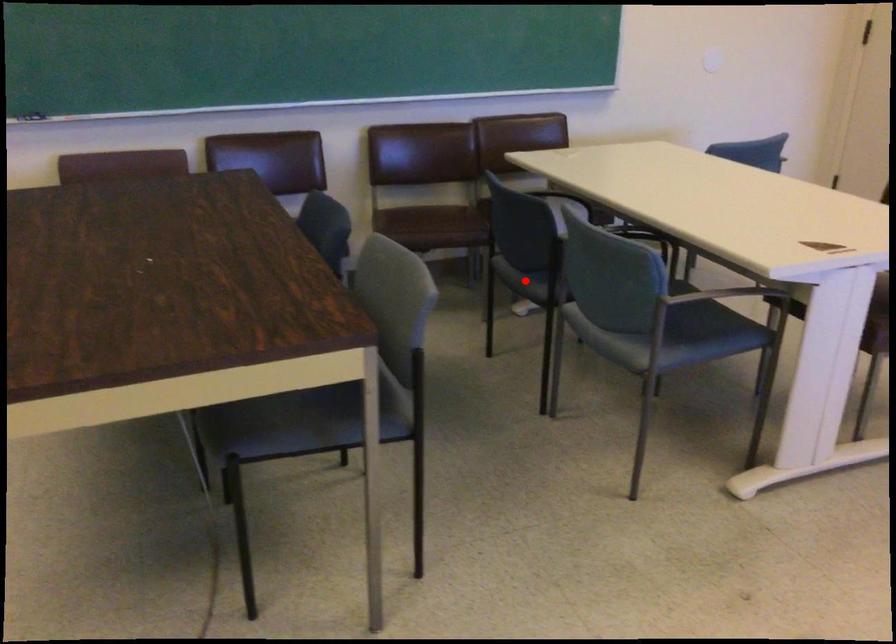
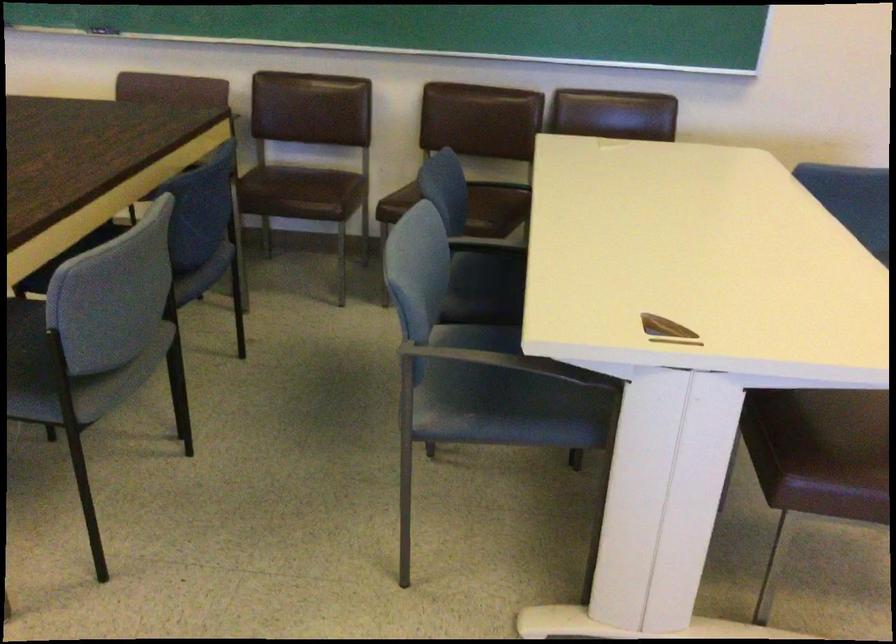
Question: I am providing you with two images of the same scene from different viewpoints. A red point is marked on the first image. Can you still see the location of the red point in image 2?

Choices:
 (A) Yes
 (B) No

Answer: (B)